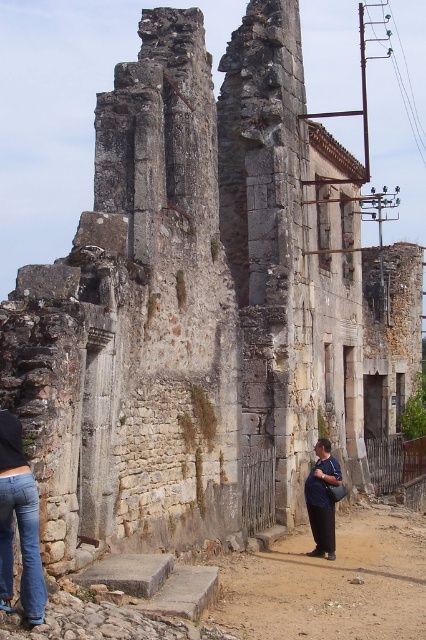
You are standing on the brown dirt path at lower center and see the dark blue jeans at lower center. Which object is closer to the ground?

The brown dirt path at lower center is located below dark blue jeans at lower center, so the brown dirt path at lower center is closer to the ground.

You are standing at the edge of the brown dirt path at lower center and want to walk to the denim jeans at lower left. Which direction should you head towards?

The brown dirt path at lower center is larger in size than denim jeans at lower left, so you should head towards the denim jeans at lower left direction.

You are a restoration worker standing at the base of the stone structure. You notice two points marked on the wall. One is at coordinate point (265, 556) and the other at point (328, 532). Which point is closer to you?

Point (265, 556) is further to the camera than point (328, 532), so the point closer to you is point (328, 532).